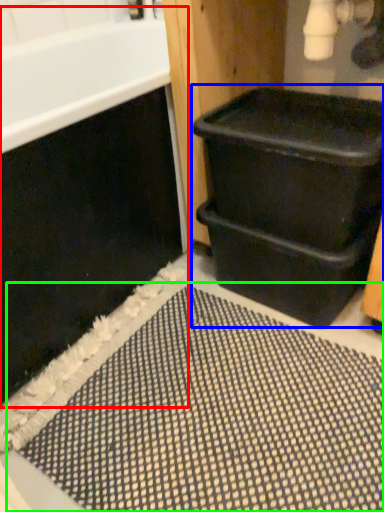
Question: Which object is positioned farthest from bath (highlighted by a red box)? Select from waste container (highlighted by a blue box) and bath mat (highlighted by a green box).

Choices:
 (A) waste container
 (B) bath mat

Answer: (B)